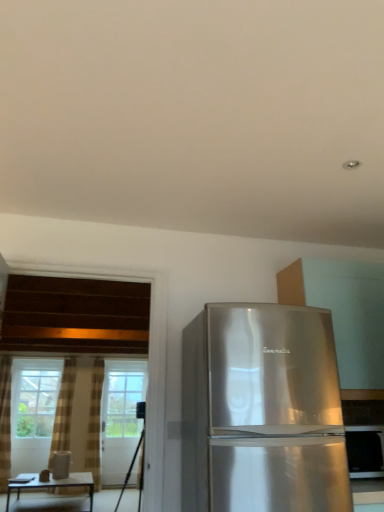
The width and height of the screenshot is (384, 512). Identify the location of clear glass window at left. tap(37, 403).

Locate an element on the screen. Image resolution: width=384 pixels, height=512 pixels. matte brown table at lower left is located at coordinates (53, 484).

How much space does plaid fabric curtain at left, arranged as the first curtain when viewed from the right, occupy horizontally?

plaid fabric curtain at left, arranged as the first curtain when viewed from the right, is 8.56 inches in width.

Measure the distance between satin silver refrigerator at right and camera.

6.80 feet.

Where is `satin silver refrigerator at right`? satin silver refrigerator at right is located at coordinates (262, 411).

Image resolution: width=384 pixels, height=512 pixels. There is a clear glass window at left. What are the coordinates of `the 1st curtain below it (from a real-world perspective)` in the screenshot? It's located at (63, 410).

Is brown textured curtain at left, which is counted as the first curtain, starting from the left, next to clear glass window at left and touching it?

brown textured curtain at left, which is counted as the first curtain, starting from the left, is not next to clear glass window at left, and they're not touching.

Is brown textured curtain at left, marked as the 2th curtain in a right-to-left arrangement, smaller than clear glass window at left?

Yes, brown textured curtain at left, marked as the 2th curtain in a right-to-left arrangement, is smaller than clear glass window at left.

Does clear glass window at left come behind satin silver refrigerator at right?

Yes, the depth of clear glass window at left is greater than that of satin silver refrigerator at right.

Considering the positions of point (49, 385) and point (210, 490), is point (49, 385) closer or farther from the camera than point (210, 490)?

Point (49, 385) is farther from the camera than point (210, 490).

Would you say clear glass window at left is a long distance from satin silver refrigerator at right?

That's right, there is a large distance between clear glass window at left and satin silver refrigerator at right.

Who is bigger, black matte tripod at lower left or satin silver refrigerator at right?

satin silver refrigerator at right is bigger.

Between black matte tripod at lower left and satin silver refrigerator at right, which one has smaller width?

With smaller width is black matte tripod at lower left.

Does point (114, 510) come closer to viewer compared to point (266, 386)?

No, it is not.

From a real-world perspective, which is physically above, black matte tripod at lower left or satin silver refrigerator at right?

satin silver refrigerator at right is physically above.

From the satin silver refrigerator at right, count the 1st curtain to the left and point to it. Please provide its 2D coordinates.

[(94, 423)]

Which is further, (93, 455) or (185, 343)?

The point (93, 455) is more distant.

Who is shorter, plaid fabric curtain at left, acting as the 2th curtain starting from the left, or satin silver refrigerator at right?

With less height is satin silver refrigerator at right.

Is matte brown table at lower left wider or thinner than clear glass screen door at center?

In the image, matte brown table at lower left appears to be wider than clear glass screen door at center.

The width and height of the screenshot is (384, 512). I want to click on table that is below the clear glass screen door at center (from the image's perspective), so click(53, 484).

Is matte brown table at lower left inside the boundaries of clear glass screen door at center, or outside?

The correct answer is: outside.

Considering the relative positions of matte brown table at lower left and clear glass screen door at center in the image provided, is matte brown table at lower left to the right of clear glass screen door at center from the viewer's perspective?

In fact, matte brown table at lower left is to the left of clear glass screen door at center.

Considering the relative positions of satin silver refrigerator at right and black matte tripod at lower left in the image provided, is satin silver refrigerator at right to the left or to the right of black matte tripod at lower left?

From the image, it's evident that satin silver refrigerator at right is to the right of black matte tripod at lower left.

Based on the photo, is satin silver refrigerator at right aimed at black matte tripod at lower left?

No, satin silver refrigerator at right is not oriented towards black matte tripod at lower left.

How different are the orientations of satin silver refrigerator at right and black matte tripod at lower left in degrees?

They differ by 7.33 degrees in their facing directions.

Considering the sizes of satin silver refrigerator at right and black matte tripod at lower left in the image, is satin silver refrigerator at right bigger or smaller than black matte tripod at lower left?

Considering their sizes, satin silver refrigerator at right takes up less space than black matte tripod at lower left.

Can you tell me how much clear glass window at left and plaid fabric curtain at left, arranged as the first curtain when viewed from the right, differ in facing direction?

Result: The facing directions of clear glass window at left and plaid fabric curtain at left, arranged as the first curtain when viewed from the right, are 1.96 degrees apart.

Is clear glass window at left beside plaid fabric curtain at left, arranged as the first curtain when viewed from the right?

No, clear glass window at left is not touching plaid fabric curtain at left, arranged as the first curtain when viewed from the right.

Is point (38, 392) closer to camera compared to point (94, 408)?

Yes, it is in front of point (94, 408).

Which curtain is the 1st one when counting from the front of the clear glass window at left? Please provide its 2D coordinates.

[(94, 423)]

There is a clear glass window at left. Identify the location of the 1st curtain below it (from a real-world perspective). This screenshot has width=384, height=512. (63, 410).

Locate an element on the screen. This screenshot has width=384, height=512. window behind the satin silver refrigerator at right is located at coordinates (37, 403).

Estimate the real-world distances between objects in this image. Which object is further from black matte tripod at lower left, satin silver refrigerator at right or matte brown table at lower left?

satin silver refrigerator at right.

When comparing their distances from satin silver refrigerator at right, does matte brown table at lower left or plaid fabric curtain at left, arranged as the first curtain when viewed from the right, seem further?

matte brown table at lower left is positioned further to the anchor satin silver refrigerator at right.

Which object lies further to the anchor point clear glass window at left, satin silver refrigerator at right or satin silver refrigerator at right?

Based on the image, satin silver refrigerator at right appears to be further to clear glass window at left.

Consider the image. When comparing their distances from satin silver refrigerator at right, does clear glass window at left or satin silver refrigerator at right seem further?

Based on the image, clear glass window at left appears to be further to satin silver refrigerator at right.

Looking at the image, which one is located further to clear glass screen door at center, satin silver refrigerator at right or satin silver refrigerator at right?

satin silver refrigerator at right is positioned further to the anchor clear glass screen door at center.

When comparing their distances from black matte tripod at lower left, does clear glass screen door at center or satin silver refrigerator at right seem further?

Based on the image, satin silver refrigerator at right appears to be further to black matte tripod at lower left.

From the image, which object appears to be nearer to matte brown table at lower left, brown textured curtain at left, which is counted as the first curtain, starting from the left, or satin silver refrigerator at right?

brown textured curtain at left, which is counted as the first curtain, starting from the left, is closer to matte brown table at lower left.

From the image, which object appears to be farther from satin silver refrigerator at right, clear glass window at left or matte brown table at lower left?

clear glass window at left lies further to satin silver refrigerator at right than the other object.

Where is `tripod positioned between satin silver refrigerator at right and clear glass window at left from near to far`? The width and height of the screenshot is (384, 512). tripod positioned between satin silver refrigerator at right and clear glass window at left from near to far is located at coordinates (130, 469).

The width and height of the screenshot is (384, 512). What are the coordinates of `window located between black matte tripod at lower left and clear glass screen door at center in the depth direction` in the screenshot? It's located at (37, 403).

Locate an element on the screen. Image resolution: width=384 pixels, height=512 pixels. tripod between satin silver refrigerator at right and plaid fabric curtain at left, acting as the 2th curtain starting from the left, along the z-axis is located at coordinates (130, 469).

Locate an element on the screen. table between satin silver refrigerator at right and plaid fabric curtain at left, acting as the 2th curtain starting from the left, in the front-back direction is located at coordinates (53, 484).